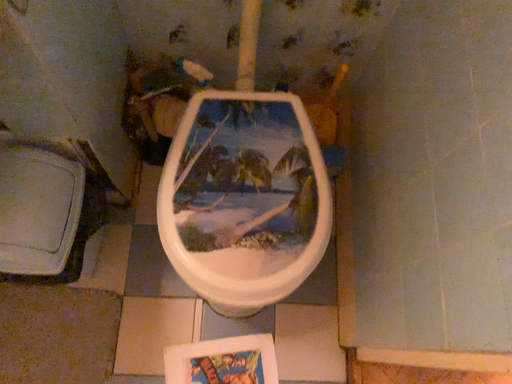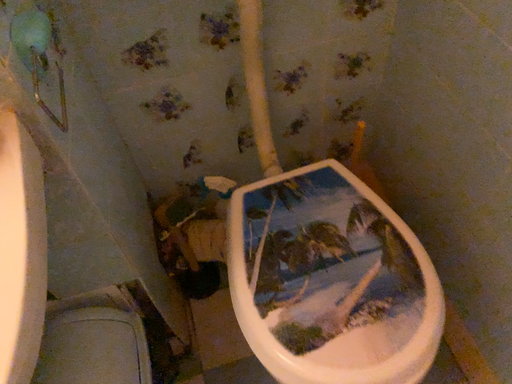
Question: Which way did the camera rotate in the video?

Choices:
 (A) rotated upward
 (B) rotated downward

Answer: (A)